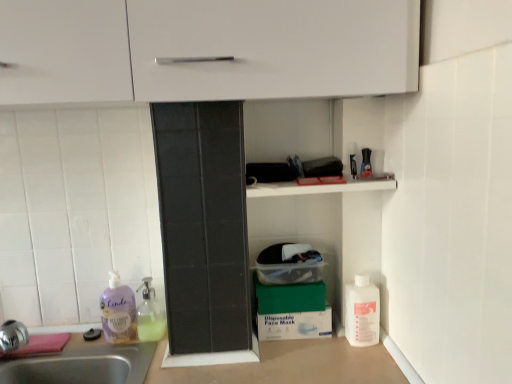
The height and width of the screenshot is (384, 512). What do you see at coordinates (150, 314) in the screenshot?
I see `translucent glass soap dispenser at lower left, the second cleaning product viewed from the left` at bounding box center [150, 314].

This screenshot has width=512, height=384. Describe the element at coordinates (118, 311) in the screenshot. I see `purple liquid soap at lower left, the first cleaning product when ordered from left to right` at that location.

Describe the element at coordinates (295, 325) in the screenshot. I see `green cardboard box at lower center` at that location.

The image size is (512, 384). What are the coordinates of `green matte box at lower center` in the screenshot? It's located at (289, 297).

Consider the image. In the image, is white plastic bottle at lower right, which appears as the 3th cleaning product when viewed from the left, on the left side or the right side of green matte box at lower center?

Clearly, white plastic bottle at lower right, which appears as the 3th cleaning product when viewed from the left, is on the right of green matte box at lower center in the image.

Locate an element on the screen. The height and width of the screenshot is (384, 512). box above the white plastic bottle at lower right, which appears as the 3th cleaning product when viewed from the left (from a real-world perspective) is located at coordinates (289, 297).

Is point (362, 298) closer to camera compared to point (273, 308)?

That is True.

Does white plastic bottle at lower right, the 1th cleaning product from the right, have a larger size compared to green matte box at lower center?

Correct, white plastic bottle at lower right, the 1th cleaning product from the right, is larger in size than green matte box at lower center.

Locate an element on the screen. The height and width of the screenshot is (384, 512). the 1st cleaning product above the green cardboard box at lower center (from the image's perspective) is located at coordinates (150, 314).

Which object is further away from the camera, translucent glass soap dispenser at lower left, the second cleaning product viewed from the left, or green cardboard box at lower center?

green cardboard box at lower center is further from the camera.

Which object is positioned more to the left, translucent glass soap dispenser at lower left, the second cleaning product viewed from the left, or green cardboard box at lower center?

translucent glass soap dispenser at lower left, the second cleaning product viewed from the left, is more to the left.

Is translucent glass soap dispenser at lower left, the second cleaning product viewed from the left, outside of green cardboard box at lower center?

Indeed, translucent glass soap dispenser at lower left, the second cleaning product viewed from the left, is completely outside green cardboard box at lower center.

Would you say purple liquid soap at lower left, the first cleaning product when ordered from left to right, is part of green cardboard box at lower center's contents?

No, purple liquid soap at lower left, the first cleaning product when ordered from left to right, is not a part of green cardboard box at lower center.

Considering the relative positions of green cardboard box at lower center and purple liquid soap at lower left, the first cleaning product when ordered from left to right, in the image provided, is green cardboard box at lower center in front of purple liquid soap at lower left, the first cleaning product when ordered from left to right,?

That is False.

Considering the sizes of green cardboard box at lower center and purple liquid soap at lower left, which ranks as the third cleaning product in right-to-left order, in the image, is green cardboard box at lower center bigger or smaller than purple liquid soap at lower left, which ranks as the third cleaning product in right-to-left order,?

green cardboard box at lower center is smaller than purple liquid soap at lower left, which ranks as the third cleaning product in right-to-left order.

How many degrees apart are the facing directions of green cardboard box at lower center and purple liquid soap at lower left, the first cleaning product when ordered from left to right?

They differ by 0.494 degrees in their facing directions.

Is green matte box at lower center positioned far away from green cardboard box at lower center?

Actually, green matte box at lower center and green cardboard box at lower center are a little close together.

Is green matte box at lower center located outside green cardboard box at lower center?

Yes.

Considering the points (301, 292) and (112, 315), which point is behind, point (301, 292) or point (112, 315)?

The point (112, 315) is behind.

From their relative heights in the image, would you say green matte box at lower center is taller or shorter than purple liquid soap at lower left, the first cleaning product when ordered from left to right?

In the image, green matte box at lower center appears to be shorter than purple liquid soap at lower left, the first cleaning product when ordered from left to right.

Consider the image. How many degrees apart are the facing directions of green matte box at lower center and purple liquid soap at lower left, the first cleaning product when ordered from left to right?

The angular difference between green matte box at lower center and purple liquid soap at lower left, the first cleaning product when ordered from left to right, is 0.494 degrees.

Which object is positioned more to the right, green matte box at lower center or purple liquid soap at lower left, which ranks as the third cleaning product in right-to-left order?

green matte box at lower center.

Can you confirm if green cardboard box at lower center is positioned to the right of green matte box at lower center?

Yes, green cardboard box at lower center is to the right of green matte box at lower center.

Does green cardboard box at lower center have a lesser height compared to green matte box at lower center?

In fact, green cardboard box at lower center may be taller than green matte box at lower center.

From a real-world perspective, is green cardboard box at lower center physically above green matte box at lower center?

No, from a real-world perspective, green cardboard box at lower center is not on top of green matte box at lower center.

From the picture: Is green cardboard box at lower center directly adjacent to green matte box at lower center?

Yes, green cardboard box at lower center and green matte box at lower center clearly make contact.

Are green cardboard box at lower center and translucent glass soap dispenser at lower left, the second cleaning product viewed from the left, beside each other?

No, green cardboard box at lower center is not in contact with translucent glass soap dispenser at lower left, the second cleaning product viewed from the left.

Looking at this image, from a real-world perspective, is green cardboard box at lower center physically below translucent glass soap dispenser at lower left, marked as the 2th cleaning product in a right-to-left arrangement?

Correct, in the physical world, green cardboard box at lower center is lower than translucent glass soap dispenser at lower left, marked as the 2th cleaning product in a right-to-left arrangement.

Considering the sizes of objects green cardboard box at lower center and translucent glass soap dispenser at lower left, marked as the 2th cleaning product in a right-to-left arrangement, in the image provided, who is thinner, green cardboard box at lower center or translucent glass soap dispenser at lower left, marked as the 2th cleaning product in a right-to-left arrangement,?

With smaller width is green cardboard box at lower center.

The width and height of the screenshot is (512, 384). In order to click on box on the left of white plastic bottle at lower right, which appears as the 3th cleaning product when viewed from the left in this screenshot , I will do `click(289, 297)`.

Where is `cardboard box that appears below the translucent glass soap dispenser at lower left, marked as the 2th cleaning product in a right-to-left arrangement (from the image's perspective)`? The width and height of the screenshot is (512, 384). cardboard box that appears below the translucent glass soap dispenser at lower left, marked as the 2th cleaning product in a right-to-left arrangement (from the image's perspective) is located at coordinates (295, 325).

When comparing their distances from translucent glass soap dispenser at lower left, the second cleaning product viewed from the left, does white plastic bottle at lower right, the 1th cleaning product from the right, or purple liquid soap at lower left, which ranks as the third cleaning product in right-to-left order, seem closer?

purple liquid soap at lower left, which ranks as the third cleaning product in right-to-left order, lies closer to translucent glass soap dispenser at lower left, the second cleaning product viewed from the left, than the other object.

Which object lies further to the anchor point green matte box at lower center, translucent glass soap dispenser at lower left, marked as the 2th cleaning product in a right-to-left arrangement, or green cardboard box at lower center?

translucent glass soap dispenser at lower left, marked as the 2th cleaning product in a right-to-left arrangement, is positioned further to the anchor green matte box at lower center.

Looking at the image, which one is located further to green cardboard box at lower center, purple liquid soap at lower left, the first cleaning product when ordered from left to right, or white plastic bottle at lower right, which appears as the 3th cleaning product when viewed from the left?

Based on the image, purple liquid soap at lower left, the first cleaning product when ordered from left to right, appears to be further to green cardboard box at lower center.

From the image, which object appears to be farther from purple liquid soap at lower left, which ranks as the third cleaning product in right-to-left order, white plastic bottle at lower right, which appears as the 3th cleaning product when viewed from the left, or green matte box at lower center?

The object further to purple liquid soap at lower left, which ranks as the third cleaning product in right-to-left order, is white plastic bottle at lower right, which appears as the 3th cleaning product when viewed from the left.

When comparing their distances from green cardboard box at lower center, does translucent glass soap dispenser at lower left, marked as the 2th cleaning product in a right-to-left arrangement, or purple liquid soap at lower left, the first cleaning product when ordered from left to right, seem closer?

translucent glass soap dispenser at lower left, marked as the 2th cleaning product in a right-to-left arrangement, lies closer to green cardboard box at lower center than the other object.

Which object lies further to the anchor point green matte box at lower center, white plastic bottle at lower right, the 1th cleaning product from the right, or translucent glass soap dispenser at lower left, the second cleaning product viewed from the left?

Based on the image, translucent glass soap dispenser at lower left, the second cleaning product viewed from the left, appears to be further to green matte box at lower center.

Based on their spatial positions, is green cardboard box at lower center or white plastic bottle at lower right, the 1th cleaning product from the right, closer to green matte box at lower center?

The object closer to green matte box at lower center is green cardboard box at lower center.

Which object lies further to the anchor point green cardboard box at lower center, green matte box at lower center or white plastic bottle at lower right, which appears as the 3th cleaning product when viewed from the left?

white plastic bottle at lower right, which appears as the 3th cleaning product when viewed from the left.

Identify the location of cardboard box between translucent glass soap dispenser at lower left, the second cleaning product viewed from the left, and white plastic bottle at lower right, which appears as the 3th cleaning product when viewed from the left, from left to right. Image resolution: width=512 pixels, height=384 pixels. 295,325.

Locate an element on the screen. cleaning product between purple liquid soap at lower left, the first cleaning product when ordered from left to right, and green matte box at lower center is located at coordinates (150, 314).

Find the location of a particular element. box situated between translucent glass soap dispenser at lower left, the second cleaning product viewed from the left, and green cardboard box at lower center from left to right is located at coordinates [289, 297].

Find the location of a particular element. box between purple liquid soap at lower left, which ranks as the third cleaning product in right-to-left order, and green cardboard box at lower center from left to right is located at coordinates (289, 297).